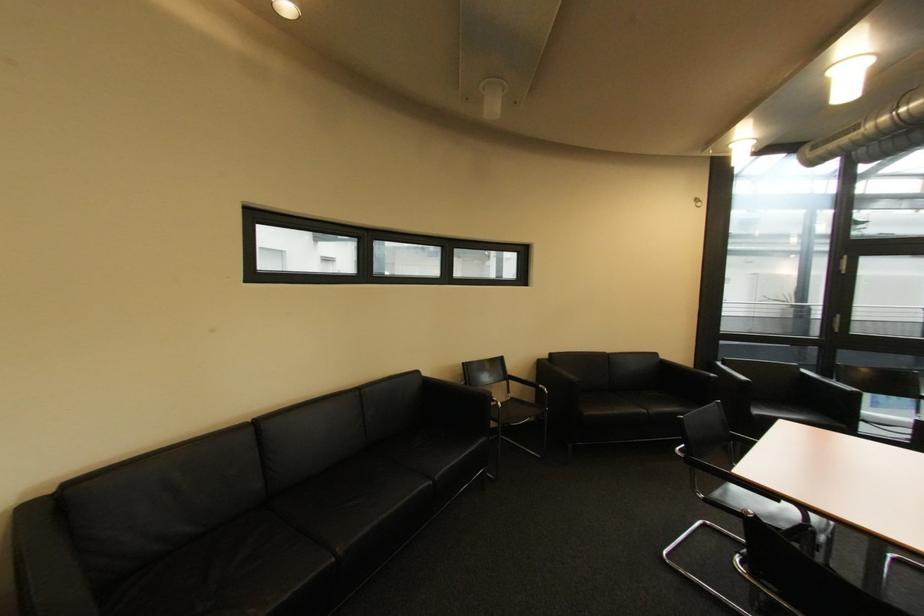
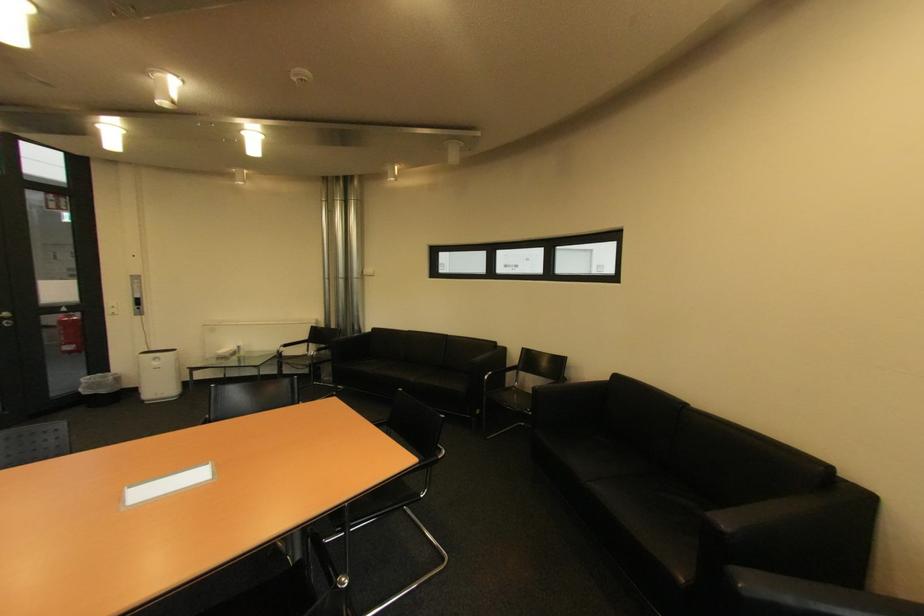
Where in the second image is the point corresponding to [560,357] from the first image?

(625, 378)